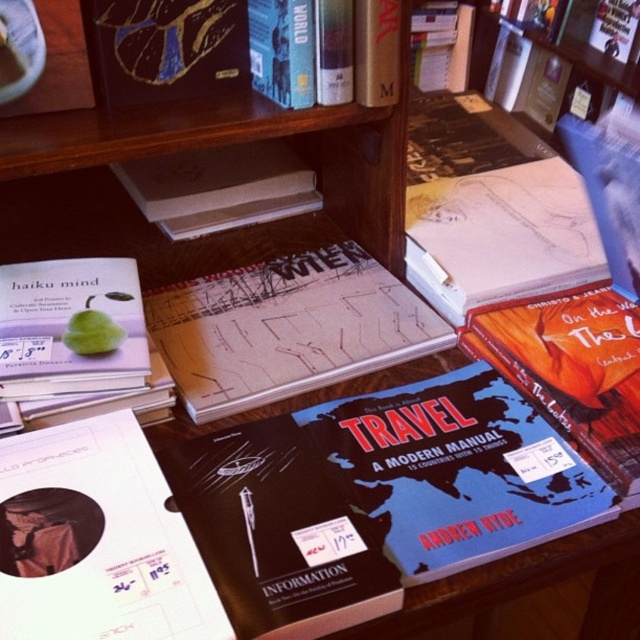
Which is behind, point (198, 552) or point (220, 10)?

Positioned behind is point (220, 10).

At what (x,y) coordinates should I click in order to perform the action: click on black matte travel guide at center. Please return your answer as a coordinate pair (x, y). The image size is (640, 640). Looking at the image, I should click on (276, 532).

The image size is (640, 640). What do you see at coordinates (276, 532) in the screenshot? I see `black matte travel guide at center` at bounding box center [276, 532].

The width and height of the screenshot is (640, 640). What are the coordinates of `black matte travel guide at center` in the screenshot? It's located at (276, 532).

Who is lower down, gold foil notebook at upper left or white matte book at center?

white matte book at center

Does gold foil notebook at upper left have a greater height compared to white matte book at center?

Incorrect, gold foil notebook at upper left's height is not larger of white matte book at center's.

Which is behind, point (182, 1) or point (157, 182)?

Positioned behind is point (157, 182).

Find the location of `gold foil notebook at upper left`. gold foil notebook at upper left is located at coordinates (164, 48).

Does white paper notebook at center appear on the left side of gold foil notebook at upper left?

No, white paper notebook at center is not to the left of gold foil notebook at upper left.

This screenshot has width=640, height=640. What do you see at coordinates (285, 328) in the screenshot?
I see `white paper notebook at center` at bounding box center [285, 328].

Find the location of a particular element. The image size is (640, 640). white paper notebook at center is located at coordinates (285, 328).